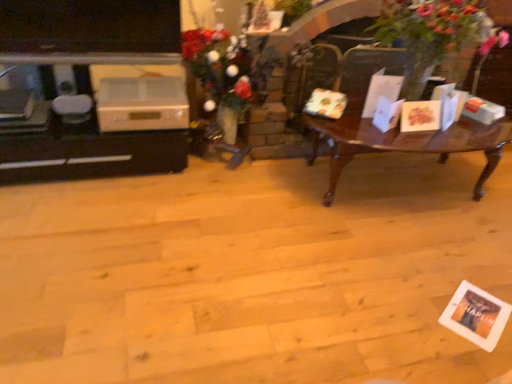
Question: From a real-world perspective, is green leafy plant at right positioned over woodenwoodencoffee table at right based on gravity?

Choices:
 (A) no
 (B) yes

Answer: (B)

Question: Does green leafy plant at right have a lesser height compared to woodenwoodencoffee table at right?

Choices:
 (A) yes
 (B) no

Answer: (B)

Question: Is green leafy plant at right wider than woodenwoodencoffee table at right?

Choices:
 (A) yes
 (B) no

Answer: (B)

Question: Is there a large distance between green leafy plant at right and woodenwoodencoffee table at right?

Choices:
 (A) yes
 (B) no

Answer: (B)

Question: From the image's perspective, is green leafy plant at right located beneath woodenwoodencoffee table at right?

Choices:
 (A) no
 (B) yes

Answer: (A)

Question: Would you say woodenwoodencoffee table at right is part of green leafy plant at right's contents?

Choices:
 (A) yes
 (B) no

Answer: (B)

Question: Can you confirm if white plastic appliance at left is wider than green leafy plant at right?

Choices:
 (A) no
 (B) yes

Answer: (A)

Question: Is white plastic appliance at left behind green leafy plant at right?

Choices:
 (A) no
 (B) yes

Answer: (B)

Question: Is white plastic appliance at left turned away from green leafy plant at right?

Choices:
 (A) no
 (B) yes

Answer: (A)

Question: Does white plastic appliance at left come in front of green leafy plant at right?

Choices:
 (A) no
 (B) yes

Answer: (A)

Question: Is white plastic appliance at left at the right side of green leafy plant at right?

Choices:
 (A) no
 (B) yes

Answer: (A)

Question: Does white plastic appliance at left have a larger size compared to green leafy plant at right?

Choices:
 (A) yes
 (B) no

Answer: (B)

Question: Is white glossy entertainment center at left smaller than white plastic appliance at left?

Choices:
 (A) yes
 (B) no

Answer: (B)